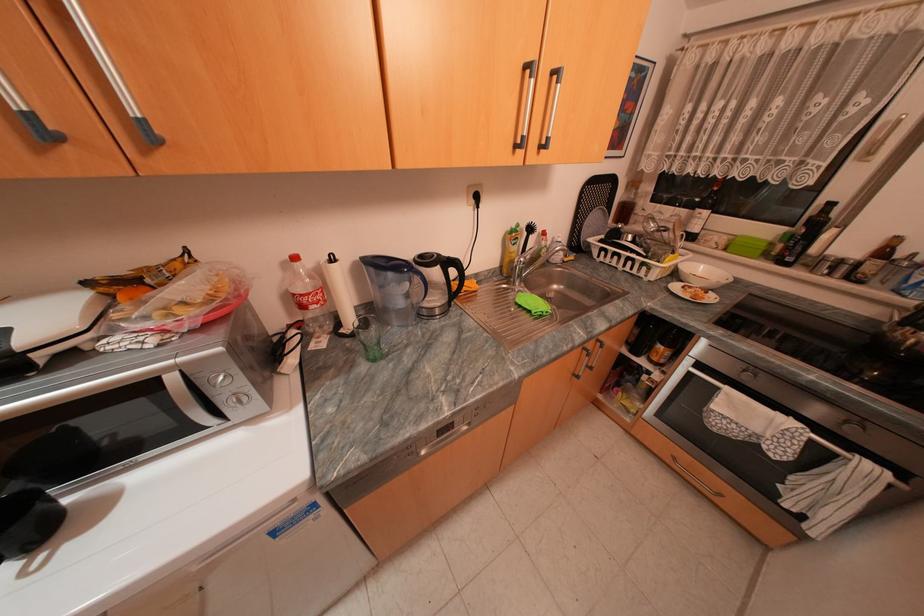
What do you see at coordinates (419, 286) in the screenshot? I see `the water pitcher handle` at bounding box center [419, 286].